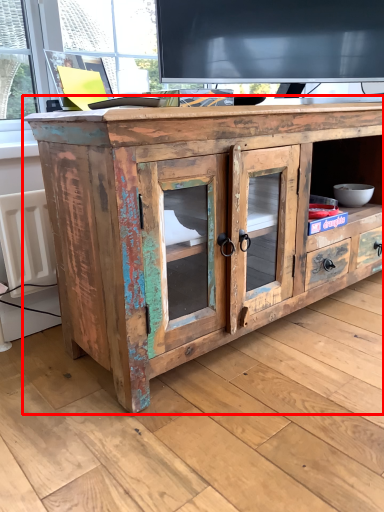
Question: From the image's perspective, considering the relative positions of chest of drawers (annotated by the red box) and radiator in the image provided, where is chest of drawers (annotated by the red box) located with respect to the staircase?

Choices:
 (A) below
 (B) above

Answer: (B)